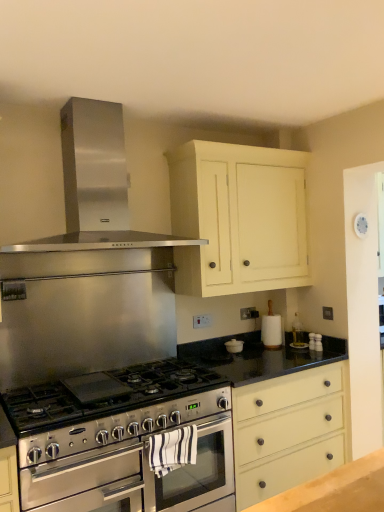
Question: Is white painted wood cabinet at upper center at the back of stainless steel oven at center, arranged as the second oven when viewed from the front?

Choices:
 (A) yes
 (B) no

Answer: (B)

Question: Are stainless steel oven at center, arranged as the second oven when viewed from the front, and white painted wood cabinet at upper center located far from each other?

Choices:
 (A) no
 (B) yes

Answer: (B)

Question: Would you say stainless steel oven at center, arranged as the second oven when viewed from the front, is outside white painted wood cabinet at upper center?

Choices:
 (A) yes
 (B) no

Answer: (A)

Question: Is stainless steel oven at center, the 1th oven in the back-to-front sequence, taller than white painted wood cabinet at upper center?

Choices:
 (A) yes
 (B) no

Answer: (B)

Question: From a real-world perspective, is stainless steel oven at center, the 1th oven in the back-to-front sequence, located beneath white painted wood cabinet at upper center?

Choices:
 (A) no
 (B) yes

Answer: (B)

Question: From the image's perspective, does stainless steel oven at center, the 1th oven in the back-to-front sequence, appear higher than white painted wood cabinet at upper center?

Choices:
 (A) no
 (B) yes

Answer: (A)

Question: Does matte cream drawer at center have a smaller size compared to white painted wood cabinet at upper center?

Choices:
 (A) yes
 (B) no

Answer: (B)

Question: Does matte cream drawer at center come in front of white painted wood cabinet at upper center?

Choices:
 (A) no
 (B) yes

Answer: (B)

Question: Does matte cream drawer at center lie behind white painted wood cabinet at upper center?

Choices:
 (A) yes
 (B) no

Answer: (B)

Question: From the image's perspective, does matte cream drawer at center appear lower than white painted wood cabinet at upper center?

Choices:
 (A) no
 (B) yes

Answer: (B)

Question: Is matte cream drawer at center wider than white painted wood cabinet at upper center?

Choices:
 (A) no
 (B) yes

Answer: (B)

Question: From a real-world perspective, does matte cream drawer at center stand above white painted wood cabinet at upper center?

Choices:
 (A) yes
 (B) no

Answer: (B)

Question: Can you confirm if matte cream drawer at center is shorter than stainless steel oven at center, which appears as the second oven when viewed from the back?

Choices:
 (A) no
 (B) yes

Answer: (A)